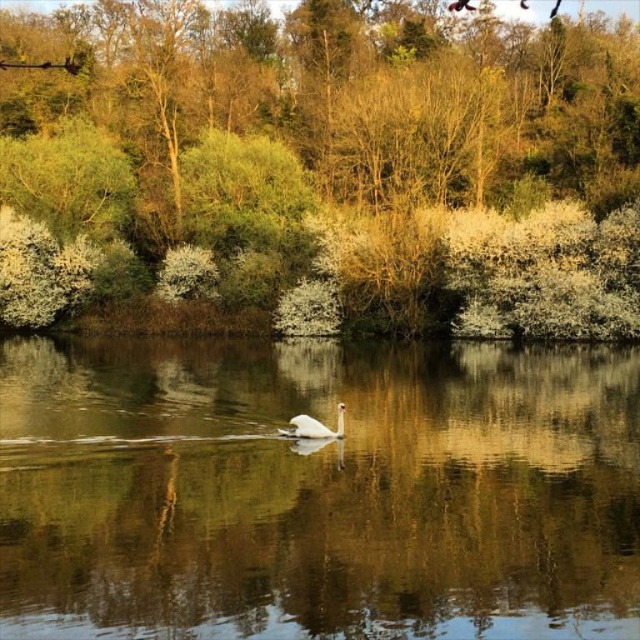
Question: Which object is positioned closest to the clear water at center?

Choices:
 (A) green leafy tree at center
 (B) white glossy swan at center

Answer: (B)

Question: Estimate the real-world distances between objects in this image. Which object is closer to the green leafy tree at center?

Choices:
 (A) clear water at center
 (B) white glossy swan at center

Answer: (A)

Question: Can you confirm if clear water at center is thinner than white glossy swan at center?

Choices:
 (A) no
 (B) yes

Answer: (A)

Question: Can you confirm if green leafy tree at center is positioned above white glossy swan at center?

Choices:
 (A) no
 (B) yes

Answer: (B)

Question: Does clear water at center have a greater width compared to white glossy swan at center?

Choices:
 (A) yes
 (B) no

Answer: (A)

Question: Estimate the real-world distances between objects in this image. Which object is farther from the white glossy swan at center?

Choices:
 (A) clear water at center
 (B) green leafy tree at center

Answer: (B)